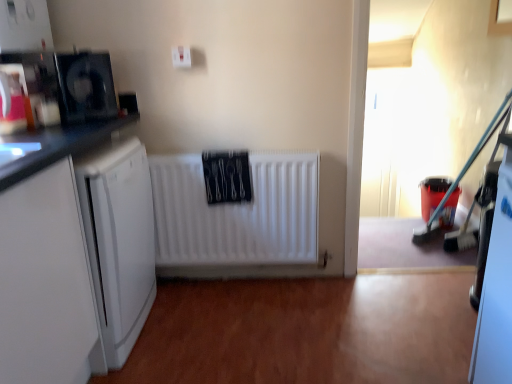
The width and height of the screenshot is (512, 384). Describe the element at coordinates (236, 213) in the screenshot. I see `white matte radiator at center` at that location.

Image resolution: width=512 pixels, height=384 pixels. I want to click on white matte radiator at center, so click(x=236, y=213).

Measure the distance between point (264,174) and camera.

6.87 feet.

In order to face white matte radiator at center, should I rotate leftwards or rightwards?

You should look left and rotate roughly 2.396 degrees.

Locate an element on the screen. white matte radiator at center is located at coordinates (236, 213).